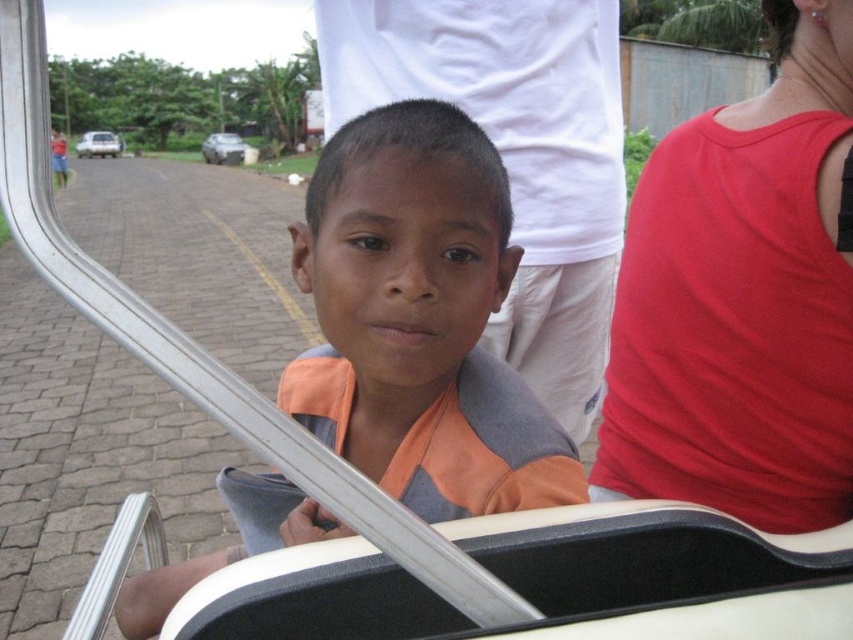
Locate an element on the screen. The width and height of the screenshot is (853, 640). orange fabric shirt at center is located at coordinates (419, 321).

Find the location of `orange fabric shirt at center`. orange fabric shirt at center is located at coordinates (419, 321).

Measure the distance from red smooth tank top at right to silver metallic car at upper left.

A distance of 104.60 feet exists between red smooth tank top at right and silver metallic car at upper left.

Who is lower down, red smooth tank top at right or silver metallic car at upper left?

Positioned lower is red smooth tank top at right.

Who is more distant from viewer, (828, 58) or (239, 145)?

The point (239, 145) is more distant.

I want to click on red smooth tank top at right, so click(x=743, y=298).

Can you confirm if orange fabric shirt at center is smaller than silver metallic car at upper left?

Yes, orange fabric shirt at center is smaller than silver metallic car at upper left.

Does orange fabric shirt at center have a lesser height compared to silver metallic car at upper left?

Correct, orange fabric shirt at center is not as tall as silver metallic car at upper left.

Between point (321, 349) and point (236, 163), which one is positioned behind?

The point (236, 163) is more distant.

Locate an element on the screen. Image resolution: width=853 pixels, height=640 pixels. orange fabric shirt at center is located at coordinates (419, 321).